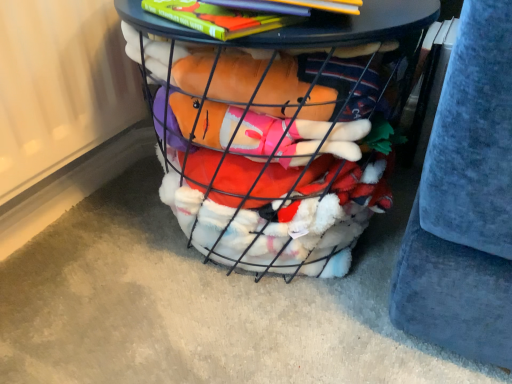
In order to face velvety blue cushion at right, should I rotate leftwards or rightwards?

To align with it, rotate right about 25.435°.

At what (x,y) coordinates should I click in order to perform the action: click on hardcover book at upper center. Please return your answer as a coordinate pair (x, y). This screenshot has height=384, width=512. Looking at the image, I should click on (218, 18).

From the image's perspective, which is above, wire mesh basket at center or hardcover book at upper center?

From the image's view, hardcover book at upper center is above.

Between wire mesh basket at center and hardcover book at upper center, which one appears on the left side from the viewer's perspective?

wire mesh basket at center.

From the picture: Is wire mesh basket at center smaller than hardcover book at upper center?

Actually, wire mesh basket at center might be larger than hardcover book at upper center.

Between point (349, 113) and point (174, 9), which one is positioned behind?

The point (349, 113) is more distant.

Between wire mesh basket at center and velvety blue cushion at right, which one has larger size?

wire mesh basket at center.

Between wire mesh basket at center and velvety blue cushion at right, which one has larger width?

velvety blue cushion at right is wider.

In the scene shown: Choose the correct answer: Is wire mesh basket at center inside velvety blue cushion at right or outside it?

wire mesh basket at center is not inside velvety blue cushion at right, it's outside.

In terms of height, does wire mesh basket at center look taller or shorter compared to velvety blue cushion at right?

Considering their sizes, wire mesh basket at center has less height than velvety blue cushion at right.

Are velvety blue cushion at right and hardcover book at upper center far apart?

No.

Can you tell me how much velvety blue cushion at right and hardcover book at upper center differ in facing direction?

The facing directions of velvety blue cushion at right and hardcover book at upper center are 22.1 degrees apart.

Considering the relative positions of velvety blue cushion at right and hardcover book at upper center in the image provided, is velvety blue cushion at right to the left of hardcover book at upper center from the viewer's perspective?

No.

In the scene shown: From the image's perspective, is velvety blue cushion at right above or below hardcover book at upper center?

From the image's perspective, velvety blue cushion at right appears above hardcover book at upper center.

Does velvety blue cushion at right turn towards wire mesh basket at center?

No.

From the picture: Is velvety blue cushion at right shorter than wire mesh basket at center?

No, velvety blue cushion at right is not shorter than wire mesh basket at center.

Which is closer to the camera, (502, 365) or (251, 175)?

Point (502, 365) appears to be closer to the viewer than point (251, 175).

Considering the sizes of objects hardcover book at upper center and velvety blue cushion at right in the image provided, who is bigger, hardcover book at upper center or velvety blue cushion at right?

velvety blue cushion at right is bigger.

Which is closer, (278, 14) or (455, 330)?

Point (278, 14) appears to be closer to the viewer than point (455, 330).

Is hardcover book at upper center to the right of velvety blue cushion at right from the viewer's perspective?

Incorrect, hardcover book at upper center is not on the right side of velvety blue cushion at right.

Is hardcover book at upper center positioned with its back to velvety blue cushion at right?

Yes.

Which is more to the right, hardcover book at upper center or wire mesh basket at center?

From the viewer's perspective, hardcover book at upper center appears more on the right side.

Which object is thinner, hardcover book at upper center or wire mesh basket at center?

Thinner between the two is hardcover book at upper center.

Does hardcover book at upper center have a greater height compared to wire mesh basket at center?

Incorrect, the height of hardcover book at upper center is not larger of that of wire mesh basket at center.

What's the angular difference between hardcover book at upper center and wire mesh basket at center's facing directions?

19 degrees.

Identify the location of furniture on the left of the hardcover book at upper center. This screenshot has height=384, width=512. (267, 151).

Image resolution: width=512 pixels, height=384 pixels. What are the coordinates of `gray on the right side of wire mesh basket at center` in the screenshot? It's located at (465, 202).

From the picture: From the image, which object appears to be farther from hardcover book at upper center, velvety blue cushion at right or wire mesh basket at center?

velvety blue cushion at right is further to hardcover book at upper center.

Considering their positions, is wire mesh basket at center positioned closer to hardcover book at upper center than velvety blue cushion at right?

The object closer to hardcover book at upper center is wire mesh basket at center.

When comparing their distances from velvety blue cushion at right, does wire mesh basket at center or hardcover book at upper center seem closer?

The object closer to velvety blue cushion at right is wire mesh basket at center.

Considering their positions, is hardcover book at upper center positioned further to wire mesh basket at center than velvety blue cushion at right?

Among the two, velvety blue cushion at right is located further to wire mesh basket at center.

From the picture: From the image, which object appears to be farther from wire mesh basket at center, velvety blue cushion at right or hardcover book at upper center?

Among the two, velvety blue cushion at right is located further to wire mesh basket at center.

Which object lies further to the anchor point velvety blue cushion at right, hardcover book at upper center or wire mesh basket at center?

Based on the image, hardcover book at upper center appears to be further to velvety blue cushion at right.

Locate an element on the screen. Image resolution: width=512 pixels, height=384 pixels. book between wire mesh basket at center and velvety blue cushion at right from left to right is located at coordinates (218, 18).